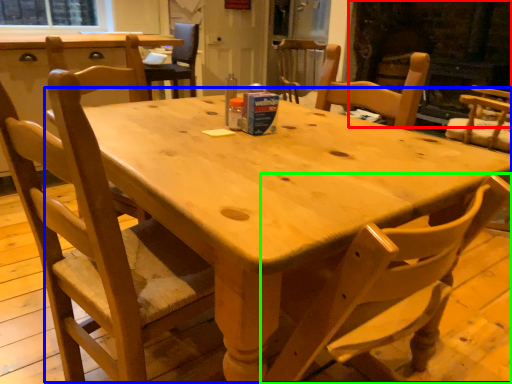
Question: Which is farther away from fireplace (highlighted by a red box)? round table (highlighted by a blue box) or chair (highlighted by a green box)?

Choices:
 (A) round table
 (B) chair

Answer: (B)